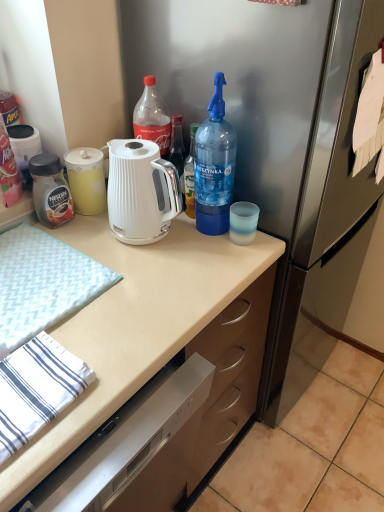
Image resolution: width=384 pixels, height=512 pixels. Identify the location of vacant area in front of white glossy electric kettle at center. (162, 277).